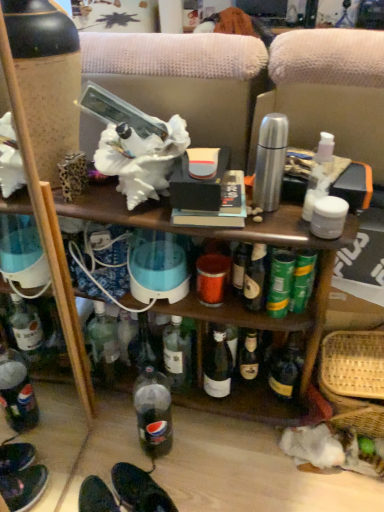
Where is `black leather shoes at lower center`? Image resolution: width=384 pixels, height=512 pixels. black leather shoes at lower center is located at coordinates (139, 490).

Describe the element at coordinates (139, 490) in the screenshot. I see `black leather shoes at lower center` at that location.

The height and width of the screenshot is (512, 384). In order to click on woven straw basket at lower right in this screenshot , I will do `click(352, 368)`.

The image size is (384, 512). What do you see at coordinates (352, 368) in the screenshot?
I see `woven straw basket at lower right` at bounding box center [352, 368].

The height and width of the screenshot is (512, 384). I want to click on black leather shoes at lower center, so click(139, 490).

Considering the relative positions of woven straw basket at lower right and black leather shoes at lower center in the image provided, is woven straw basket at lower right to the left or to the right of black leather shoes at lower center?

Based on their positions, woven straw basket at lower right is located to the right of black leather shoes at lower center.

Is woven straw basket at lower right closer to camera compared to black leather shoes at lower center?

No, woven straw basket at lower right is further to the viewer.

Considering the points (348, 348) and (169, 509), which point is in front, point (348, 348) or point (169, 509)?

Positioned in front is point (169, 509).

From the image's perspective, does woven straw basket at lower right appear lower than black leather shoes at lower center?

Incorrect, from the image's perspective, woven straw basket at lower right is higher than black leather shoes at lower center.

Consider the image. From a real-world perspective, is woven straw basket at lower right positioned over black leather shoes at lower center based on gravity?

Yes.

Looking at this image, considering the relative sizes of woven straw basket at lower right and black leather shoes at lower center in the image provided, is woven straw basket at lower right wider than black leather shoes at lower center?

Yes, woven straw basket at lower right is wider than black leather shoes at lower center.

Considering the sizes of objects woven straw basket at lower right and black leather shoes at lower center in the image provided, who is shorter, woven straw basket at lower right or black leather shoes at lower center?

Standing shorter between the two is black leather shoes at lower center.

Is woven straw basket at lower right bigger than black leather shoes at lower center?

Indeed, woven straw basket at lower right has a larger size compared to black leather shoes at lower center.

Is woven straw basket at lower right not within black leather shoes at lower center?

A: Absolutely, woven straw basket at lower right is external to black leather shoes at lower center.

Is woven straw basket at lower right not close to black leather shoes at lower center?

They are positioned close to each other.

Could you tell me if woven straw basket at lower right is turned towards black leather shoes at lower center?

No, woven straw basket at lower right is not turned towards black leather shoes at lower center.

Find the location of `basket that is behind the black leather shoes at lower center`. basket that is behind the black leather shoes at lower center is located at coordinates (352, 368).

Based on their positions, is black leather shoes at lower center located to the left or right of woven straw basket at lower right?

black leather shoes at lower center is to the left of woven straw basket at lower right.

In the image, is black leather shoes at lower center positioned in front of or behind woven straw basket at lower right?

In the image, black leather shoes at lower center appears in front of woven straw basket at lower right.

Which is more distant, (117, 487) or (345, 395)?

Answer: The point (345, 395) is behind.

From the image's perspective, is black leather shoes at lower center located above or below woven straw basket at lower right?

black leather shoes at lower center is below woven straw basket at lower right.

From a real-world perspective, is black leather shoes at lower center physically located above or below woven straw basket at lower right?

black leather shoes at lower center is situated lower than woven straw basket at lower right in the real world.

Which object is wider, black leather shoes at lower center or woven straw basket at lower right?

Wider between the two is woven straw basket at lower right.

From their relative heights in the image, would you say black leather shoes at lower center is taller or shorter than woven straw basket at lower right?

black leather shoes at lower center is shorter than woven straw basket at lower right.

Who is smaller, black leather shoes at lower center or woven straw basket at lower right?

With smaller size is black leather shoes at lower center.

Is black leather shoes at lower center not within woven straw basket at lower right?

Indeed, black leather shoes at lower center is completely outside woven straw basket at lower right.

Are black leather shoes at lower center and woven straw basket at lower right far apart?

No, black leather shoes at lower center is in close proximity to woven straw basket at lower right.

Is black leather shoes at lower center aimed at woven straw basket at lower right?

No.

What's the angular difference between black leather shoes at lower center and woven straw basket at lower right's facing directions?

There is a 129-degree angle between the facing directions of black leather shoes at lower center and woven straw basket at lower right.

You are a GUI agent. You are given a task and a screenshot of the screen. Output one action in this format:
    pyautogui.click(x=<x>, y=<y>)
    Task: Click on the basket located behind the black leather shoes at lower center
    Image resolution: width=384 pixels, height=512 pixels.
    Given the screenshot: What is the action you would take?
    pyautogui.click(x=352, y=368)

At what (x,y) coordinates should I click in order to perform the action: click on basket lying on the right of black leather shoes at lower center. Please return your answer as a coordinate pair (x, y). The width and height of the screenshot is (384, 512). Looking at the image, I should click on pos(352,368).

Find the location of a particular element. The width and height of the screenshot is (384, 512). footwear on the left side of woven straw basket at lower right is located at coordinates (139, 490).